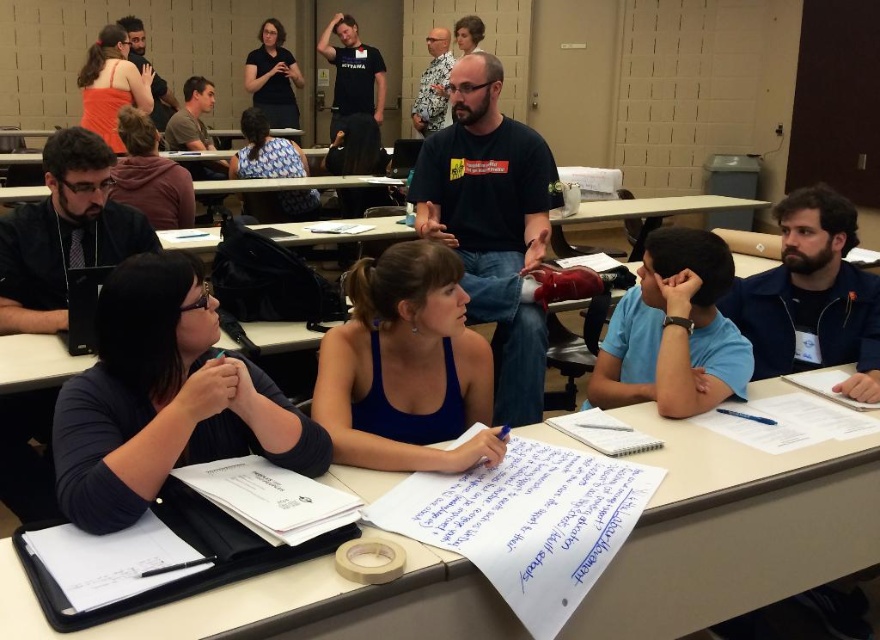
Is white paper at center shorter than dark blue shirt at left?

Yes.

Which is in front, point (651, 560) or point (180, 305)?

Positioned in front is point (180, 305).

Is point (462, 572) farther from camera compared to point (68, 396)?

No, it is not.

This screenshot has height=640, width=880. What are the coordinates of `white paper at center` in the screenshot? It's located at (732, 531).

Between point (680, 493) and point (357, 276), which one is positioned behind?

Point (357, 276)

Find the location of a particular element. The image size is (880, 640). white paper at center is located at coordinates (732, 531).

Identify the location of white paper at center. (732, 531).

Is dark blue shirt at left thinner than blue tank top at center?

No, dark blue shirt at left is not thinner than blue tank top at center.

Does dark blue shirt at left lie in front of blue tank top at center?

Yes, it is in front of blue tank top at center.

Locate an element on the screen. dark blue shirt at left is located at coordinates (165, 397).